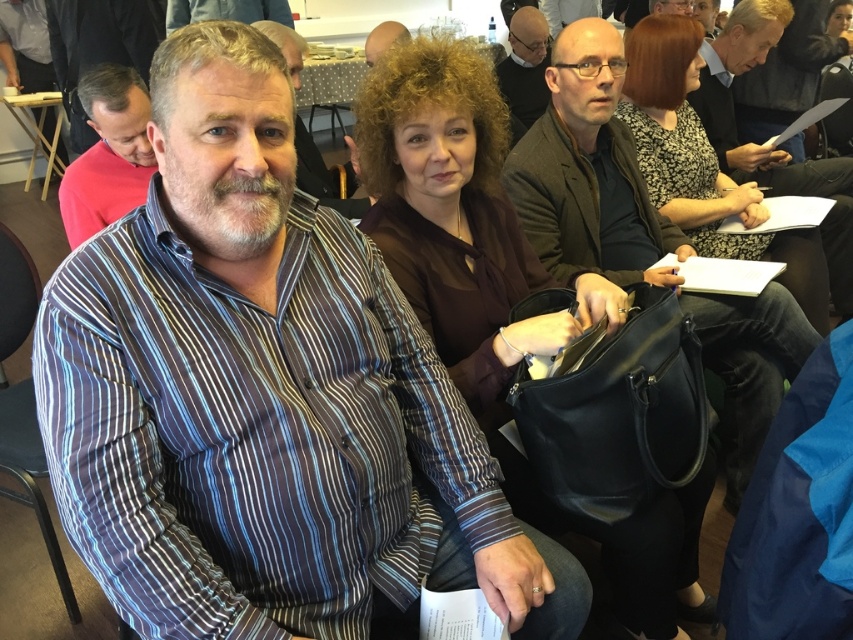
You are organizing a photo shoot and need to arrange the subjects based on their clothing sizes. If you have a matte black shirt at center and a striped shirt at center, which one should you place first in a sequence from largest to smallest?

The matte black shirt at center is larger in size than the striped shirt at center, so you should place the matte black shirt at center first in the sequence from largest to smallest.

Based on the scene description, where exactly is the matte black shirt at center located in the image?

The matte black shirt at center is located at point coordinates of (525, 68).